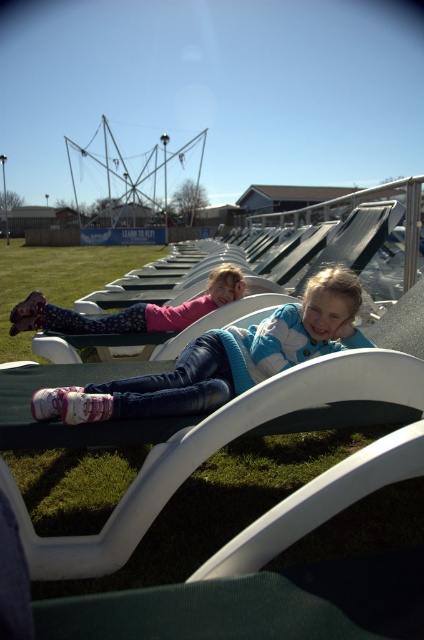
You are a lifeguard standing at the edge of the lounge chairs. You need to reach both the blue striped sweater at center and the matte pink sweater at center to check for safety. Given that your maximum reach is 5 feet, can you comfortably retrieve both without moving your position?

The distance between the blue striped sweater at center and the matte pink sweater at center is 5.22 feet, which exceeds your maximum reach of 5 feet. Therefore, you cannot comfortably retrieve both without moving your position.

You are a parent trying to locate your child who is wearing a pink sweater. You see the green grass at center and the matte pink sweater at center. Which object is taller?

The green grass at center is taller than the matte pink sweater at center.

You are standing at the edge of the grassy field and want to reach the matte pink sweater at center without stepping on the green grass at center. Is this possible?

The green grass at center is further to the viewer than the matte pink sweater at center, so you can reach the matte pink sweater at center without stepping on the green grass at center by approaching it from the front.